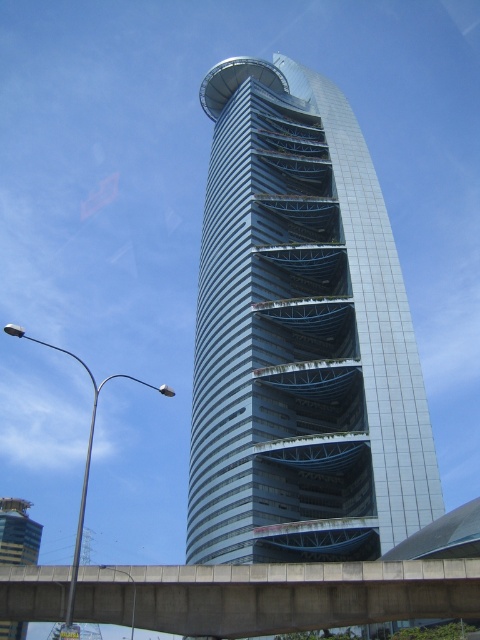
Who is lower down, metallic glass tower at center or concrete bridge at center?

concrete bridge at center is lower down.

This screenshot has height=640, width=480. Find the location of `metallic glass tower at center`. metallic glass tower at center is located at coordinates (300, 336).

From the picture: Is metallic glass tower at center positioned before metallic silver tower at lower left?

No, it is behind metallic silver tower at lower left.

Who is positioned more to the left, metallic glass tower at center or metallic silver tower at lower left?

metallic silver tower at lower left

Is point (225, 113) more distant than point (24, 506)?

No, (225, 113) is in front of (24, 506).

Where is `metallic glass tower at center`? metallic glass tower at center is located at coordinates (300, 336).

Is the position of concrete bridge at center more distant than that of metallic silver tower at lower left?

No, concrete bridge at center is closer to the viewer.

This screenshot has height=640, width=480. What do you see at coordinates (276, 595) in the screenshot?
I see `concrete bridge at center` at bounding box center [276, 595].

You are a GUI agent. You are given a task and a screenshot of the screen. Output one action in this format:
    pyautogui.click(x=<x>, y=<y>)
    Task: Click on the concrete bridge at center
    Image resolution: width=480 pixels, height=640 pixels.
    Given the screenshot: What is the action you would take?
    (x=276, y=595)